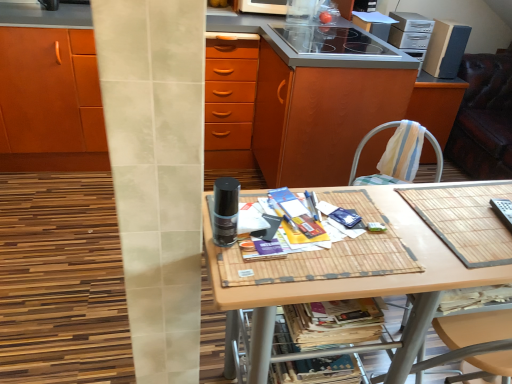
You are a GUI agent. You are given a task and a screenshot of the screen. Output one action in this format:
    pyautogui.click(x=<x>, y=<y>)
    Task: Click on the free point above bamboo mat at center (from a real-world perspective)
    
    Given the screenshot: What is the action you would take?
    pyautogui.click(x=392, y=226)